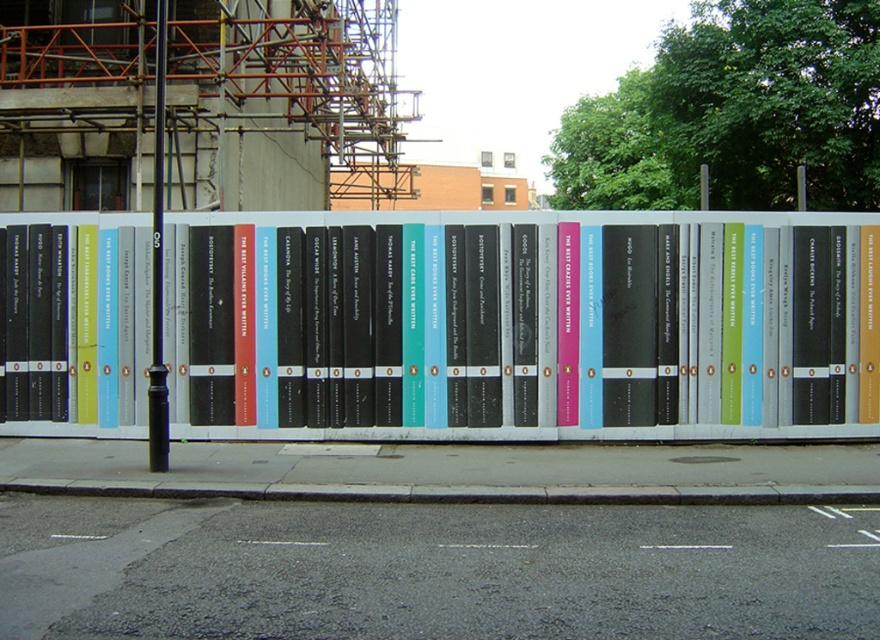
Between metallic bookshelf at center and black metal pole at center, which one is positioned higher?

black metal pole at center is higher up.

Measure the distance between metallic bookshelf at center and black metal pole at center.

The distance of metallic bookshelf at center from black metal pole at center is 4.07 meters.

Which is behind, point (528, 307) or point (151, 310)?

The point (151, 310) is more distant.

Find the location of a particular element. The height and width of the screenshot is (640, 880). metallic bookshelf at center is located at coordinates (525, 323).

Is gray concrete curb at lower center further to camera compared to black metal pole at center?

No, gray concrete curb at lower center is in front of black metal pole at center.

Does gray concrete curb at lower center appear on the left side of black metal pole at center?

In fact, gray concrete curb at lower center is to the right of black metal pole at center.

Is point (189, 484) farther from viewer compared to point (156, 410)?

No, (189, 484) is closer to viewer.

You are a GUI agent. You are given a task and a screenshot of the screen. Output one action in this format:
    pyautogui.click(x=<x>, y=<y>)
    Task: Click on the gray concrete curb at lower center
    
    Given the screenshot: What is the action you would take?
    (x=459, y=492)

Is point (352, 326) positioned in front of point (780, 502)?

No, it is behind (780, 502).

Is point (412, 323) farther from camera compared to point (796, 502)?

Yes.

Which is in front, point (488, 310) or point (518, 492)?

Point (518, 492) is in front.

Find the location of a particular element. The height and width of the screenshot is (640, 880). metallic bookshelf at center is located at coordinates (525, 323).